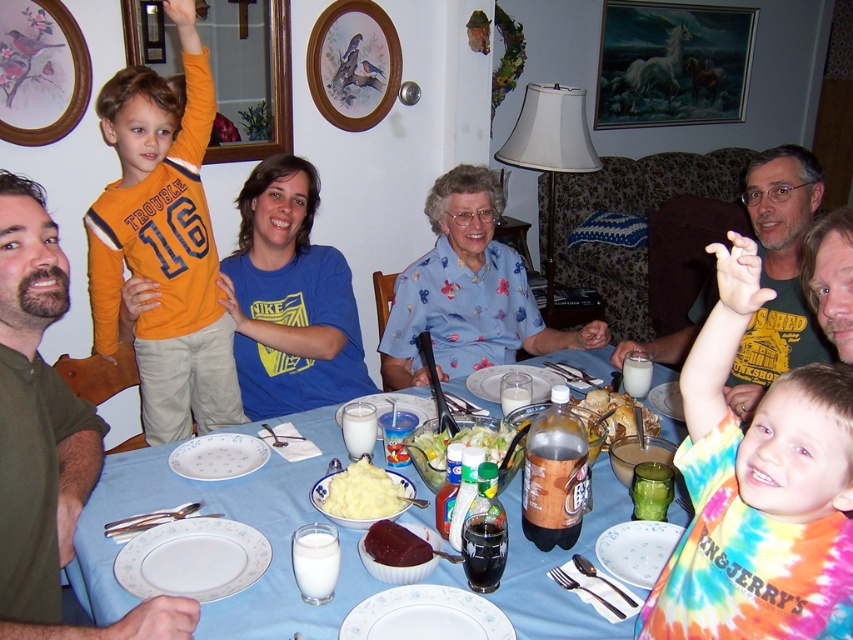
Question: Based on their relative distances, which object is nearer to the white porcelain plate at lower left?

Choices:
 (A) white ceramic plate at lower center
 (B) green leafy salad at center
 (C) dark red meat at center
 (D) white creamy mashed potatoes at center

Answer: (D)

Question: Which point is closer to the camera?

Choices:
 (A) blue plastic table at center
 (B) white porcelain plate at lower left

Answer: (A)

Question: Is white ceramic plate at center further to camera compared to golden brown bread at center?

Choices:
 (A) yes
 (B) no

Answer: (B)

Question: Which point is closer to the camera?

Choices:
 (A) blue floral dress at center
 (B) green shirt at left

Answer: (B)

Question: Is blue plastic table at center bigger than dark red meat at center?

Choices:
 (A) no
 (B) yes

Answer: (B)

Question: Is white ceramic plate at lower center wider than golden brown bread at center?

Choices:
 (A) yes
 (B) no

Answer: (B)